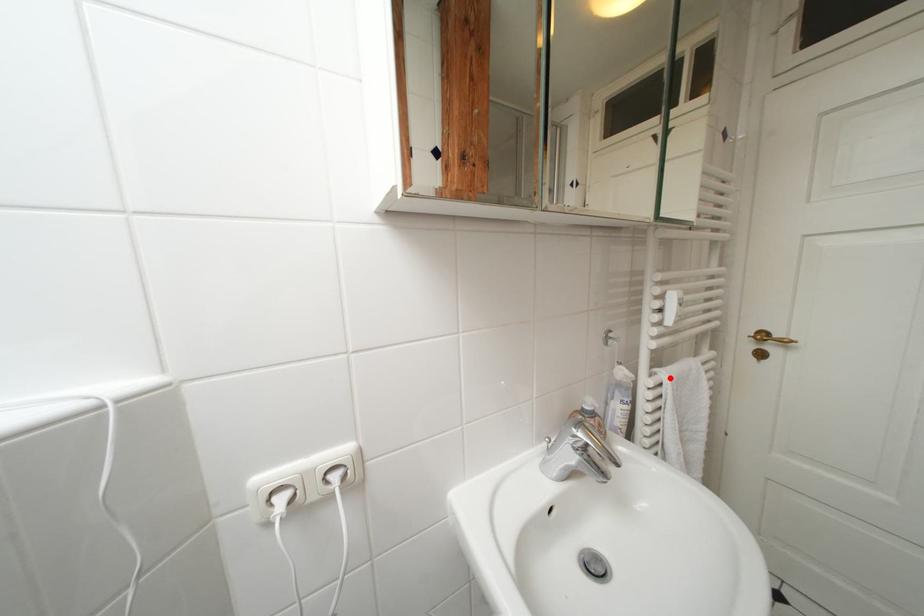
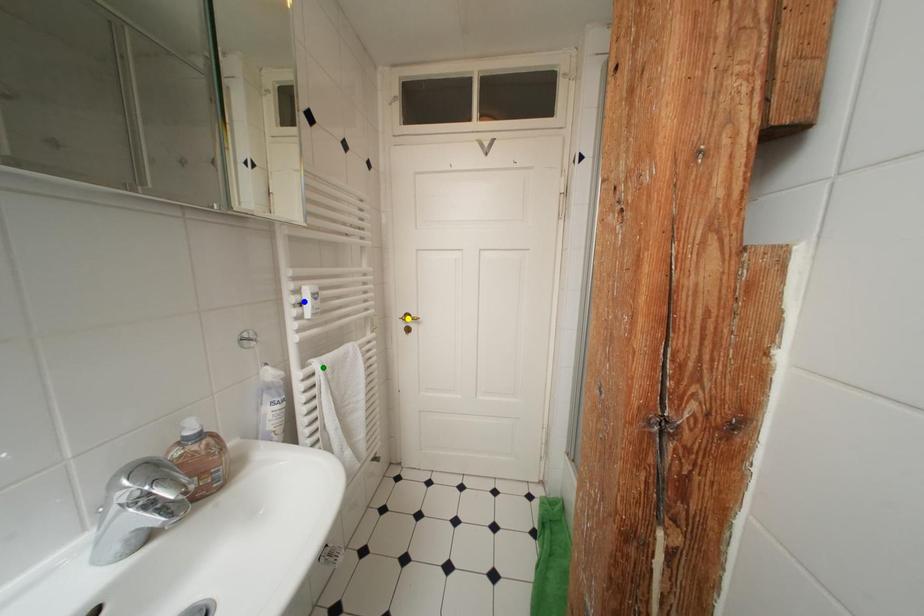
Question: I am providing you with two images of the same scene from different viewpoints. A red point is marked on the first image. You are given multiple points on the second image. In image 2, which mark is for the same physical point as the one in image 1?

Choices:
 (A) blue point
 (B) yellow point
 (C) green point

Answer: (C)